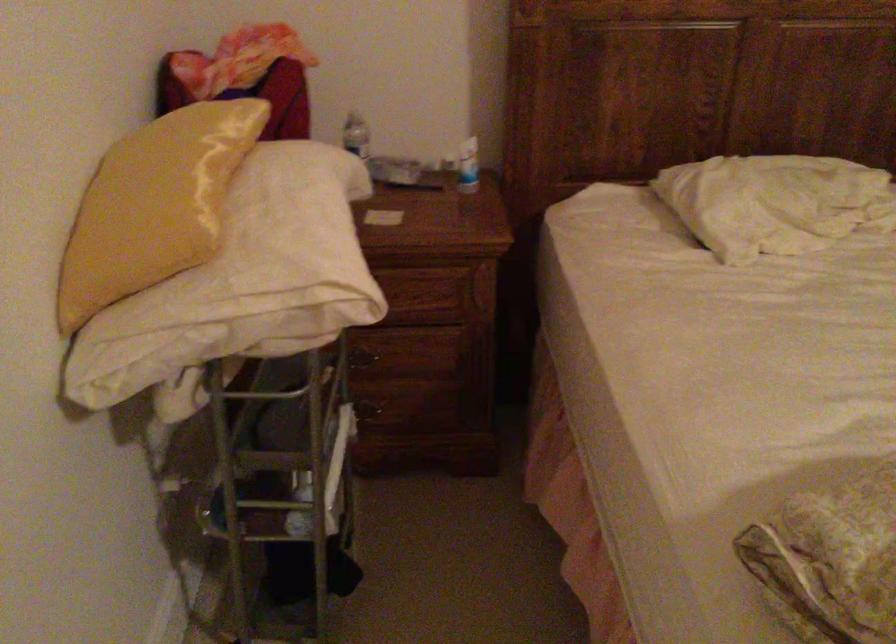
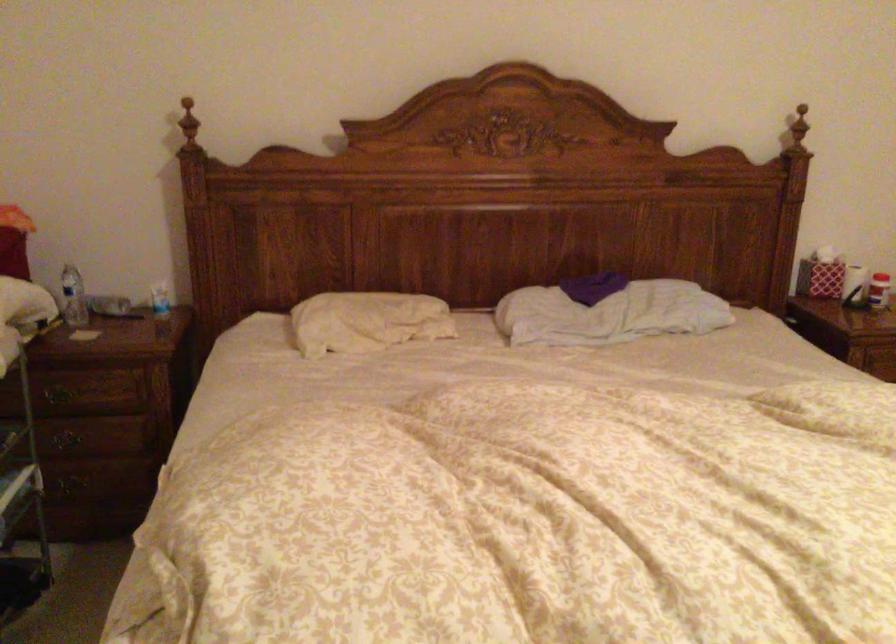
Question: The first image is from the beginning of the video and the second image is from the end. How did the camera likely rotate when shooting the video?

Choices:
 (A) Left
 (B) Right
 (C) Up
 (D) Down

Answer: (C)